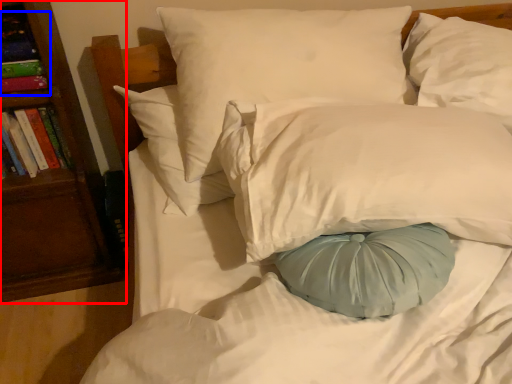
Question: Which point is closer to the camera, bookshelf (highlighted by a red box) or book (highlighted by a blue box)?

Choices:
 (A) bookshelf
 (B) book

Answer: (A)